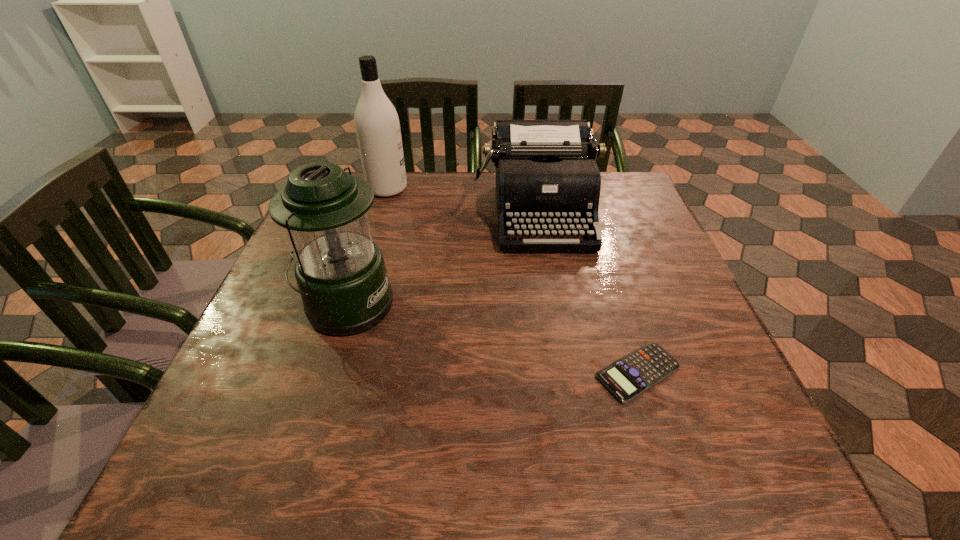
Where is `typewriter at the far edge`? typewriter at the far edge is located at coordinates (547, 178).

Where is `shampoo located in the left edge section of the desktop`? This screenshot has width=960, height=540. shampoo located in the left edge section of the desktop is located at coordinates (377, 125).

The height and width of the screenshot is (540, 960). Identify the location of lantern that is at the left edge. (340, 272).

Find the location of `typewriter present at the right edge`. typewriter present at the right edge is located at coordinates (547, 178).

This screenshot has width=960, height=540. I want to click on calculator located in the right edge section of the desktop, so click(x=628, y=377).

I want to click on object that is positioned at the far left corner, so click(377, 125).

Where is `object that is at the far right corner`? This screenshot has height=540, width=960. object that is at the far right corner is located at coordinates (547, 178).

Locate an element on the screen. This screenshot has height=540, width=960. vacant space at the far edge is located at coordinates tap(401, 204).

In the image, there is a desktop. Where is `vacant space at the near edge`? This screenshot has width=960, height=540. vacant space at the near edge is located at coordinates (640, 440).

In the image, there is a desktop. At what (x,y) coordinates should I click in order to perform the action: click on vacant area at the right edge. Please return your answer as a coordinate pair (x, y). Looking at the image, I should click on (687, 288).